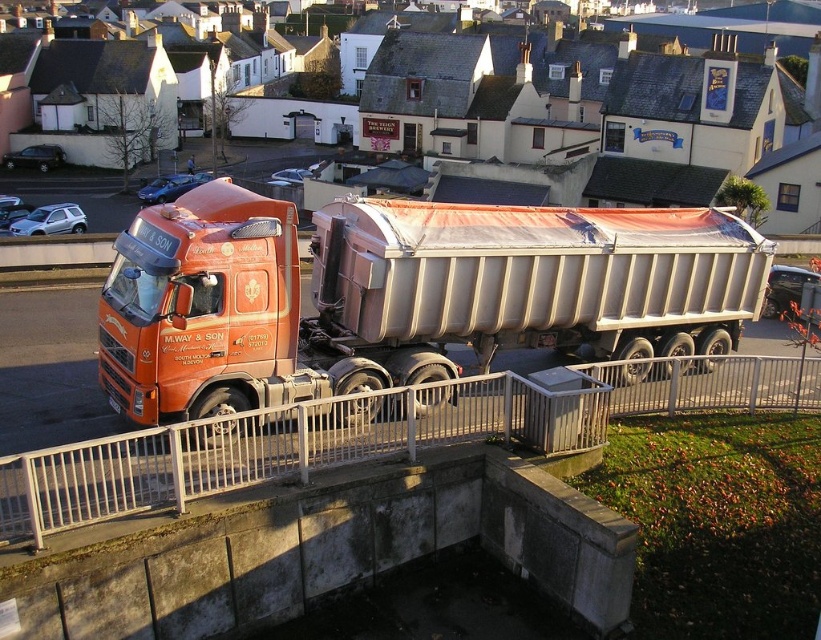
You are a pedestrian standing on the metallic silver railing at lower center. You want to cross the street to reach the matte orange trailer truck at center. Which direction should you walk to get to the truck?

The matte orange trailer truck at center is to the left of the metallic silver railing at lower center, so you should walk to the left to reach it.

You are a delivery person trying to park your small van next to the matte orange trailer truck at center. There is a metallic silver railing at lower center nearby. Based on the scene, can your van fit between the trailer truck and the railing?

The matte orange trailer truck at center is larger than the metallic silver railing at lower center, so there might be enough space for your van to fit between them. However, since the exact distance isn not provided, it depends on how much space is available between the two objects.